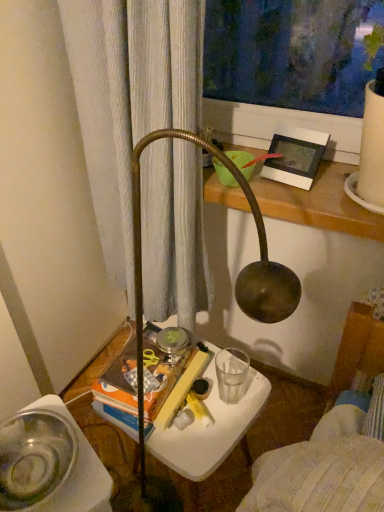
Question: Should I look upward or downward to see white plastic table at center?

Choices:
 (A) down
 (B) up

Answer: (A)

Question: Considering the relative positions of white plastic picture frame at upper right and white plastic table at center in the image provided, is white plastic picture frame at upper right behind white plastic table at center?

Choices:
 (A) no
 (B) yes

Answer: (A)

Question: Considering the relative sizes of white plastic picture frame at upper right and white plastic table at center in the image provided, is white plastic picture frame at upper right bigger than white plastic table at center?

Choices:
 (A) yes
 (B) no

Answer: (B)

Question: Can you confirm if white plastic picture frame at upper right is taller than white plastic table at center?

Choices:
 (A) no
 (B) yes

Answer: (A)

Question: Can you confirm if white plastic picture frame at upper right is wider than white plastic table at center?

Choices:
 (A) yes
 (B) no

Answer: (B)

Question: Can you confirm if white plastic picture frame at upper right is thinner than white plastic table at center?

Choices:
 (A) no
 (B) yes

Answer: (B)

Question: Is white plastic picture frame at upper right facing away from white plastic table at center?

Choices:
 (A) no
 (B) yes

Answer: (A)

Question: Is clear glass water at lower center facing towards metallic silver bowl at lower left?

Choices:
 (A) yes
 (B) no

Answer: (B)

Question: Can you see clear glass water at lower center touching metallic silver bowl at lower left?

Choices:
 (A) no
 (B) yes

Answer: (A)

Question: Is clear glass water at lower center to the left of metallic silver bowl at lower left from the viewer's perspective?

Choices:
 (A) yes
 (B) no

Answer: (B)

Question: Does clear glass water at lower center have a greater width compared to metallic silver bowl at lower left?

Choices:
 (A) no
 (B) yes

Answer: (A)

Question: Considering the relative positions of clear glass water at lower center and metallic silver bowl at lower left in the image provided, is clear glass water at lower center to the right of metallic silver bowl at lower left from the viewer's perspective?

Choices:
 (A) no
 (B) yes

Answer: (B)

Question: Considering the relative sizes of clear glass water at lower center and metallic silver bowl at lower left in the image provided, is clear glass water at lower center smaller than metallic silver bowl at lower left?

Choices:
 (A) yes
 (B) no

Answer: (A)

Question: Is white plastic picture frame at upper right further to camera compared to clear glass water at lower center?

Choices:
 (A) yes
 (B) no

Answer: (B)